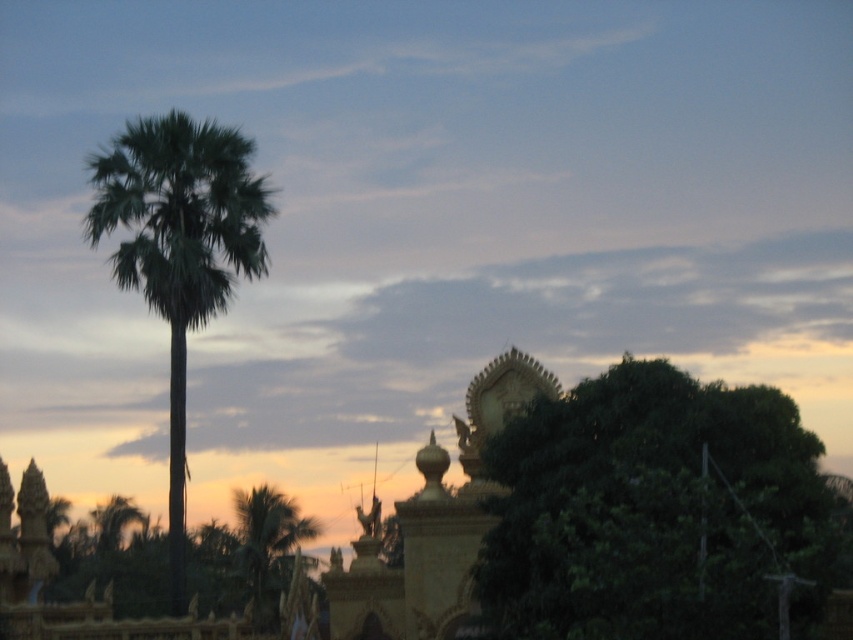
You are a hiker who wants to cross a narrow path that runs between the green leafy tree at lower right and the green leafy palm tree at lower left. The path is 100 feet wide. Can you safely cross without needing to go around?

The distance between the green leafy tree at lower right and the green leafy palm tree at lower left is 115.27 feet, which is wider than the 100 feet path. Therefore, you can safely cross the path without needing to go around.

You are standing at the point marked by the coordinates point (656, 513) in the image. Looking around, you see a tall palm tree on the left and a dense cluster of dark green foliage to the right. Which direction should you walk to reach the tall palm tree on the left?

The point marked by point (656, 513) is located at the green leafy tree at lower right. To reach the tall palm tree on the left, you should walk towards the left direction from your current position.

You are standing in the scene and want to walk towards the green leafy palm tree at lower left. Which direction should you move relative to the green leafy palm at left?

You should move downward relative to the green leafy palm at left because the green leafy palm tree at lower left is positioned below it.